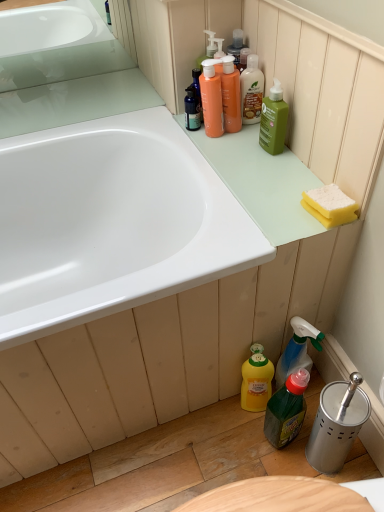
Find the location of a particular element. free space in front of translucent plastic mouthwash at upper center is located at coordinates (242, 154).